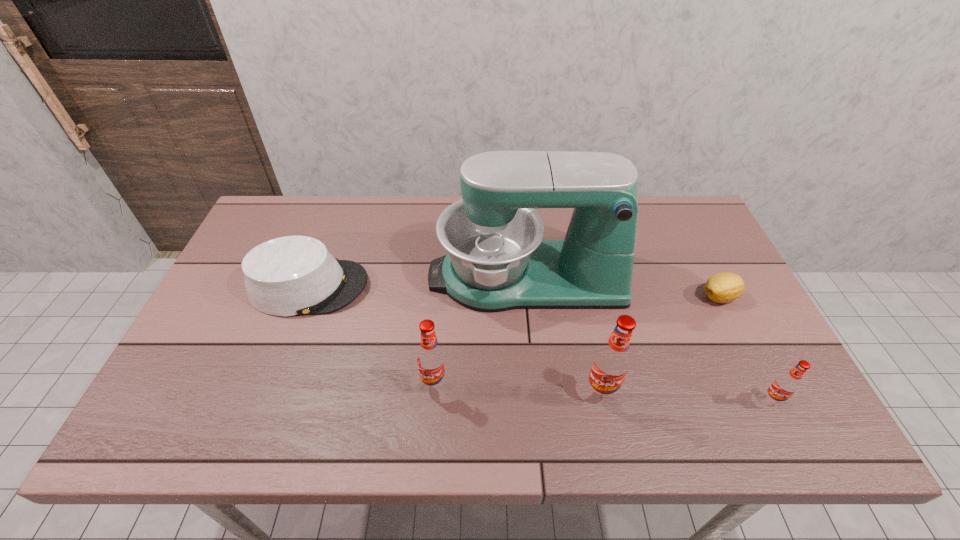
The image size is (960, 540). Find the location of `the leftmost root beer`. the leftmost root beer is located at coordinates (431, 360).

Identify the location of the third tallest object. This screenshot has height=540, width=960. (431, 360).

This screenshot has width=960, height=540. I want to click on the second root beer from right to left, so click(612, 361).

At what (x,y) coordinates should I click in order to perform the action: click on the shortest root beer. Please return your answer as a coordinate pair (x, y). Looking at the image, I should click on (786, 384).

This screenshot has width=960, height=540. Identify the location of the rightmost root beer. coord(786,384).

Identify the location of hat. The image size is (960, 540). (287, 276).

The height and width of the screenshot is (540, 960). I want to click on the leftmost object, so click(287, 276).

You are a GUI agent. You are given a task and a screenshot of the screen. Output one action in this format:
    pyautogui.click(x=<x>, y=<y>)
    Task: Click on the lemon
    
    Given the screenshot: What is the action you would take?
    pyautogui.click(x=725, y=287)

Find the location of a particular element. The height and width of the screenshot is (540, 960). mixer is located at coordinates (497, 260).

Find the location of a particular element. blank area located 0.340m on the back of the second shortest root beer is located at coordinates (444, 272).